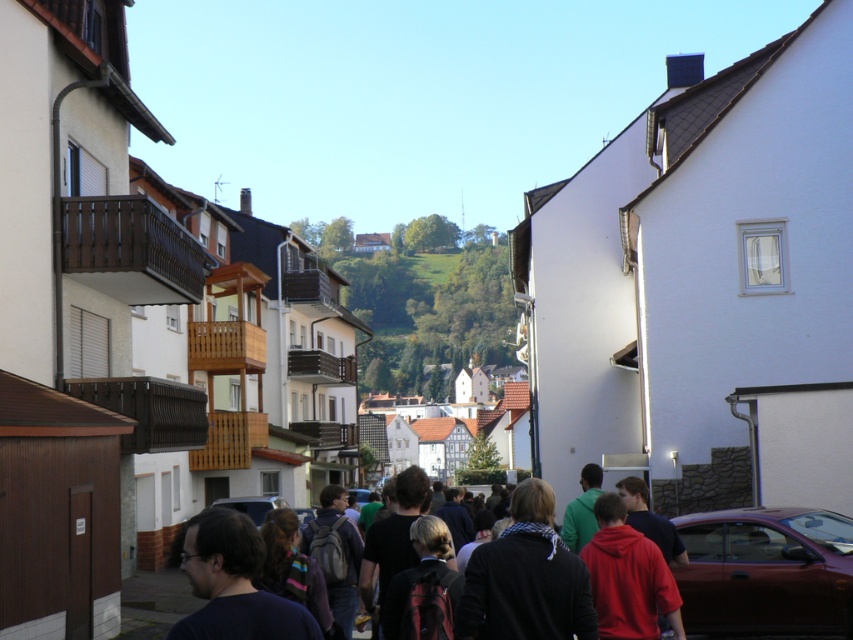
Question: Can you confirm if shiny metallic car at lower right is positioned to the right of dark clothing group at center?

Choices:
 (A) yes
 (B) no

Answer: (A)

Question: Is shiny metallic car at lower right smaller than dark clothing group at center?

Choices:
 (A) no
 (B) yes

Answer: (B)

Question: Which point is closer to the camera?

Choices:
 (A) dark clothing group at center
 (B) shiny metallic car at lower right

Answer: (A)

Question: Considering the relative positions of shiny metallic car at lower right and dark clothing group at center in the image provided, where is shiny metallic car at lower right located with respect to dark clothing group at center?

Choices:
 (A) left
 (B) right

Answer: (B)